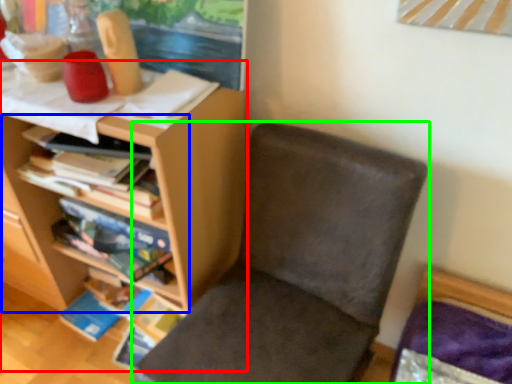
Question: Which is farther away from shelf (highlighted by a red box)? shelf (highlighted by a blue box) or chair (highlighted by a green box)?

Choices:
 (A) shelf
 (B) chair

Answer: (B)